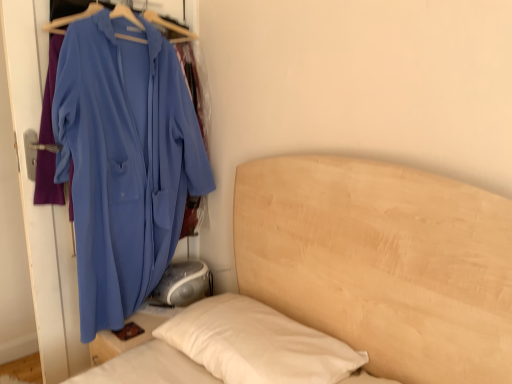
Question: Is point (116, 230) closer or farther from the camera than point (479, 340)?

Choices:
 (A) closer
 (B) farther

Answer: (B)

Question: Looking at their shapes, would you say matte blue jacket at left is wider or thinner than wooden bed at center?

Choices:
 (A) thin
 (B) wide

Answer: (A)

Question: Considering the positions of matte blue jacket at left and wooden bed at center in the image, is matte blue jacket at left bigger or smaller than wooden bed at center?

Choices:
 (A) small
 (B) big

Answer: (A)

Question: Based on their positions, is wooden bed at center located to the left or right of matte blue jacket at left?

Choices:
 (A) left
 (B) right

Answer: (B)

Question: Based on their sizes in the image, would you say wooden bed at center is bigger or smaller than matte blue jacket at left?

Choices:
 (A) big
 (B) small

Answer: (A)

Question: From the image's perspective, is wooden bed at center located above or below matte blue jacket at left?

Choices:
 (A) above
 (B) below

Answer: (B)

Question: In terms of width, does wooden bed at center look wider or thinner when compared to matte blue jacket at left?

Choices:
 (A) thin
 (B) wide

Answer: (B)